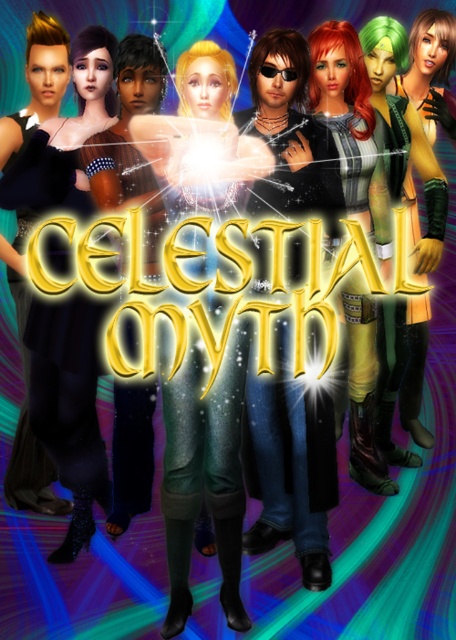
You are a costume designer preparing for a photoshoot. You have two outfits at the center of the scene, the shiny black leather jacket at center and the matte black dress at center. Which one is taller?

The shiny black leather jacket at center has a greater height compared to the matte black dress at center, so the shiny black leather jacket at center is taller.

You are an artist trying to recreate the image. You need to place the shiny black leather jacket at center in your drawing. According to the coordinates provided, where should you position it?

The shiny black leather jacket at center should be positioned at coordinates point (x=290, y=467) as specified.

You are a costume designer preparing for a play based on the celestial theme. You have two green matte items in the image. Which one is shorter in height between the green matte boots at center and the green matte jacket at right?

The green matte boots at center is shorter in height compared to the green matte jacket at right.